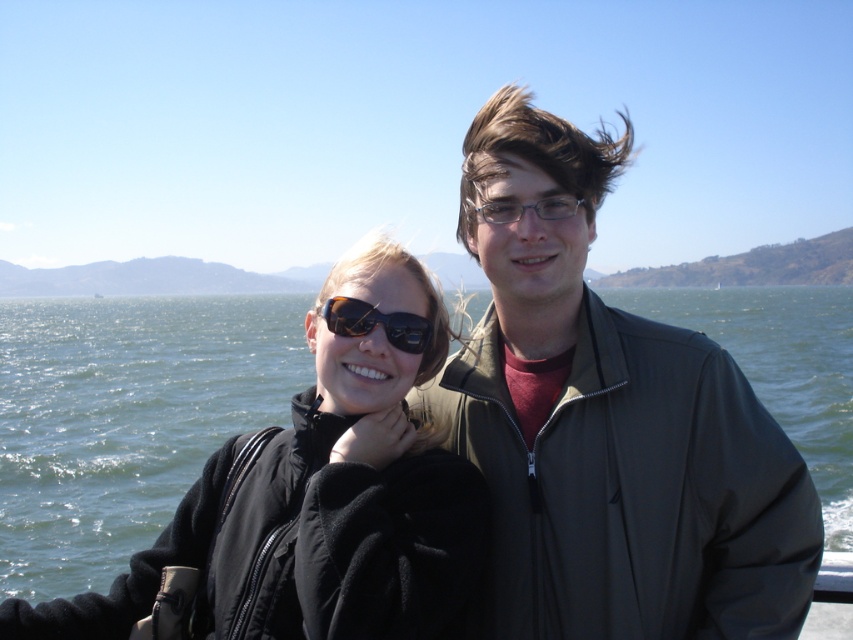
Between dark gray jacket at center and green water at center, which one has more height?

Standing taller between the two is green water at center.

Locate an element on the screen. The width and height of the screenshot is (853, 640). dark gray jacket at center is located at coordinates (607, 422).

Is dark gray jacket at center in front of matte black sunglasses at center?

Yes, dark gray jacket at center is in front of matte black sunglasses at center.

Does point (485, 624) lie behind point (409, 317)?

Yes, point (485, 624) is behind point (409, 317).

In order to click on dark gray jacket at center in this screenshot , I will do `click(607, 422)`.

Is green water at center below matte black sunglasses at center?

No.

The image size is (853, 640). In order to click on green water at center in this screenshot , I will do pos(125,419).